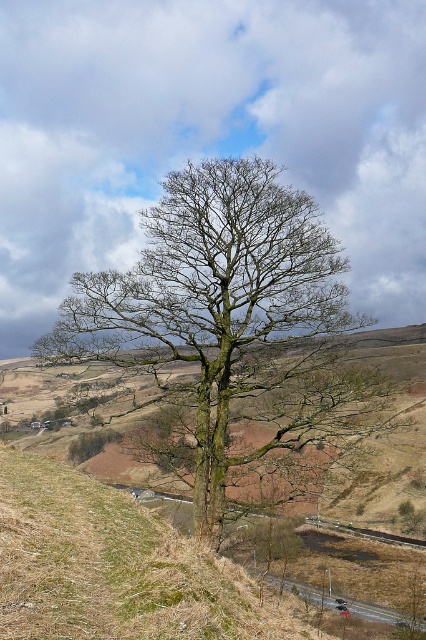
You are standing in front of the green mossy tree at center and want to walk towards the green mossy grass at center. Which direction should you move relative to the tree?

The green mossy grass at center is behind the green mossy tree at center, so you should move backward away from the tree to reach it.

You are standing at the point marked by coordinates point (233, 337) in the image. What object are you directly facing?

You are directly facing the green mossy tree at center as indicated by the point (233, 337).